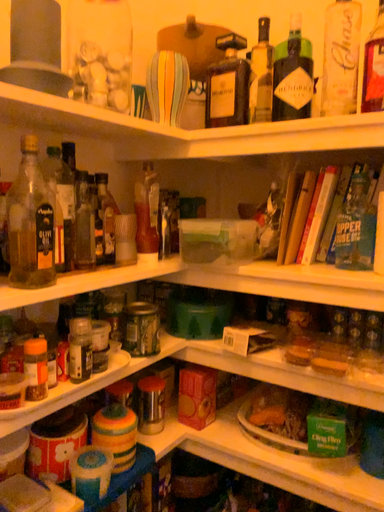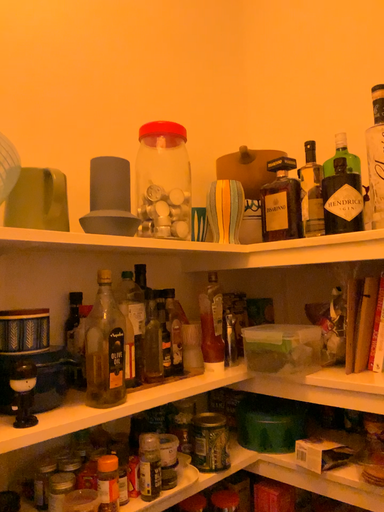
Question: How did the camera likely rotate when shooting the video?

Choices:
 (A) rotated downward
 (B) rotated upward

Answer: (B)